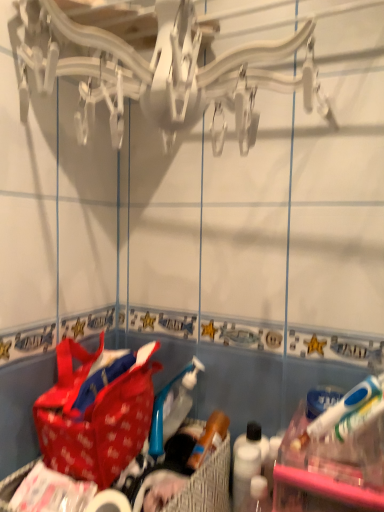
Find the location of a particular element. red fabric picnic basket at lower center is located at coordinates (207, 485).

Where is `red fabric handbag at lower left`? This screenshot has width=384, height=512. red fabric handbag at lower left is located at coordinates (95, 414).

Locate an element on the screen. This screenshot has height=512, width=384. white matte toilet paper at lower center is located at coordinates (109, 502).

Is white matte toilet paper at lower center positioned far away from red fabric handbag at lower left?

Actually, white matte toilet paper at lower center and red fabric handbag at lower left are a little close together.

From the image's perspective, who appears lower, white matte toilet paper at lower center or red fabric handbag at lower left?

From the image's view, white matte toilet paper at lower center is below.

Is white matte toilet paper at lower center in front of red fabric handbag at lower left?

Yes, white matte toilet paper at lower center is closer to the camera.

Does white matte toilet paper at lower center have a lesser width compared to red fabric handbag at lower left?

Yes.

Relative to white matte toilet paper at lower center, is red fabric handbag at lower left in front or behind?

Visually, red fabric handbag at lower left is located behind white matte toilet paper at lower center.

Based on the photo, visually, is red fabric handbag at lower left positioned to the left or to the right of white matte toilet paper at lower center?

red fabric handbag at lower left is to the left of white matte toilet paper at lower center.

Considering the relative sizes of red fabric handbag at lower left and white matte toilet paper at lower center in the image provided, is red fabric handbag at lower left thinner than white matte toilet paper at lower center?

In fact, red fabric handbag at lower left might be wider than white matte toilet paper at lower center.

How much distance is there between red fabric handbag at lower left and white matte toilet paper at lower center?

red fabric handbag at lower left is 5.73 inches away from white matte toilet paper at lower center.

Identify the location of handbag above the red fabric picnic basket at lower center (from the image's perspective). 95,414.

In the scene shown: Is red fabric handbag at lower left looking in the opposite direction of red fabric picnic basket at lower center?

No, red fabric picnic basket at lower center is not at the back of red fabric handbag at lower left.

Between point (107, 408) and point (220, 508), which one is positioned in front?

The point (107, 408) is closer to the camera.

Can you confirm if red fabric handbag at lower left is shorter than red fabric picnic basket at lower center?

In fact, red fabric handbag at lower left may be taller than red fabric picnic basket at lower center.

How many degrees apart are the facing directions of red fabric picnic basket at lower center and white matte toilet paper at lower center?

1.5 degrees separate the facing orientations of red fabric picnic basket at lower center and white matte toilet paper at lower center.

Which is less distant, (196, 492) or (99, 494)?

Point (196, 492) is farther from the camera than point (99, 494).

Is red fabric picnic basket at lower center touching white matte toilet paper at lower center?

No.

In terms of size, does red fabric picnic basket at lower center appear bigger or smaller than white matte toilet paper at lower center?

Clearly, red fabric picnic basket at lower center is larger in size than white matte toilet paper at lower center.

From the image's perspective, relative to red fabric picnic basket at lower center, is white matte toilet paper at lower center above or below?

Clearly, from the image's perspective, white matte toilet paper at lower center is above red fabric picnic basket at lower center.

What's the angular difference between white matte toilet paper at lower center and red fabric picnic basket at lower center's facing directions?

1.5 degrees.

From the picture: Would you say white matte toilet paper at lower center is a long distance from red fabric picnic basket at lower center?

Actually, white matte toilet paper at lower center and red fabric picnic basket at lower center are a little close together.

Is white matte toilet paper at lower center further to camera compared to red fabric picnic basket at lower center?

That is True.

How many degrees apart are the facing directions of red fabric picnic basket at lower center and red fabric handbag at lower left?

The facing directions of red fabric picnic basket at lower center and red fabric handbag at lower left are 1.57 degrees apart.

From the image's perspective, relative to red fabric handbag at lower left, is red fabric picnic basket at lower center above or below?

red fabric picnic basket at lower center is below red fabric handbag at lower left.

Considering the sizes of objects red fabric picnic basket at lower center and red fabric handbag at lower left in the image provided, who is thinner, red fabric picnic basket at lower center or red fabric handbag at lower left?

red fabric handbag at lower left.

Is red fabric picnic basket at lower center facing away from red fabric handbag at lower left?

No, red fabric picnic basket at lower center is not facing away from red fabric handbag at lower left.

Locate an element on the screen. The image size is (384, 512). handbag positioned vertically above the white matte toilet paper at lower center (from a real-world perspective) is located at coordinates (95, 414).

Locate an element on the screen. This screenshot has height=512, width=384. handbag on the left of white matte toilet paper at lower center is located at coordinates (95, 414).

Looking at the image, which one is located further to red fabric picnic basket at lower center, white matte toilet paper at lower center or red fabric handbag at lower left?

red fabric handbag at lower left is positioned further to the anchor red fabric picnic basket at lower center.

When comparing their distances from red fabric handbag at lower left, does white matte toilet paper at lower center or red fabric picnic basket at lower center seem closer?

white matte toilet paper at lower center lies closer to red fabric handbag at lower left than the other object.

Considering their positions, is red fabric handbag at lower left positioned further to white matte toilet paper at lower center than red fabric picnic basket at lower center?

red fabric handbag at lower left is further to white matte toilet paper at lower center.

Estimate the real-world distances between objects in this image. Which object is further from white matte toilet paper at lower center, red fabric picnic basket at lower center or red fabric handbag at lower left?

Based on the image, red fabric handbag at lower left appears to be further to white matte toilet paper at lower center.

Estimate the real-world distances between objects in this image. Which object is closer to red fabric handbag at lower left, red fabric picnic basket at lower center or white matte toilet paper at lower center?

Among the two, white matte toilet paper at lower center is located nearer to red fabric handbag at lower left.

From the image, which object appears to be farther from red fabric picnic basket at lower center, red fabric handbag at lower left or white matte toilet paper at lower center?

Based on the image, red fabric handbag at lower left appears to be further to red fabric picnic basket at lower center.

You are a GUI agent. You are given a task and a screenshot of the screen. Output one action in this format:
    pyautogui.click(x=<x>, y=<y>)
    Task: Click on the toilet paper between red fabric picnic basket at lower center and red fabric handbag at lower left from front to back
    
    Given the screenshot: What is the action you would take?
    pyautogui.click(x=109, y=502)